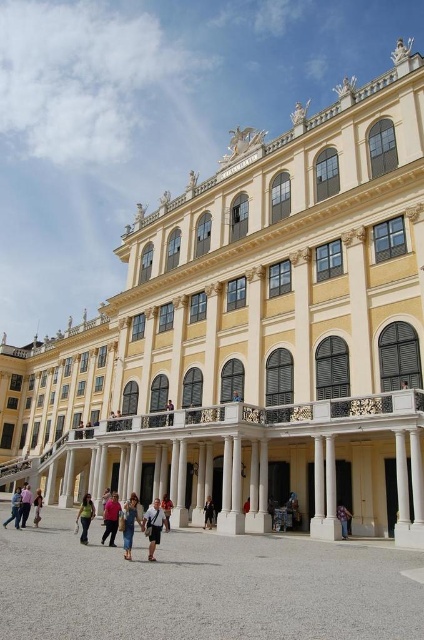
Does gray stone courtyard at center come behind denim jacket at center?

No, gray stone courtyard at center is closer to the viewer.

Can you confirm if gray stone courtyard at center is positioned below denim jacket at center?

Incorrect, gray stone courtyard at center is not positioned below denim jacket at center.

Is point (373, 627) closer to camera compared to point (170, 500)?

Yes, it is.

Locate an element on the screen. gray stone courtyard at center is located at coordinates (204, 588).

Which is behind, point (78, 512) or point (27, 513)?

Point (78, 512)

Can you confirm if green fabric bag at lower left is thinner than light brown leather jacket at lower left?

Correct, green fabric bag at lower left's width is less than light brown leather jacket at lower left's.

Describe the element at coordinates (84, 516) in the screenshot. I see `green fabric bag at lower left` at that location.

Where is `green fabric bag at lower left`? The image size is (424, 640). green fabric bag at lower left is located at coordinates (84, 516).

In the scene shown: Can you confirm if light brown leather jacket at lower left is shorter than purple cotton shirt at lower center?

Incorrect, light brown leather jacket at lower left's height does not fall short of purple cotton shirt at lower center's.

Identify the location of light brown leather jacket at lower left. Image resolution: width=424 pixels, height=640 pixels. (25, 502).

Where is `light brown leather jacket at lower left`? This screenshot has height=640, width=424. light brown leather jacket at lower left is located at coordinates (25, 502).